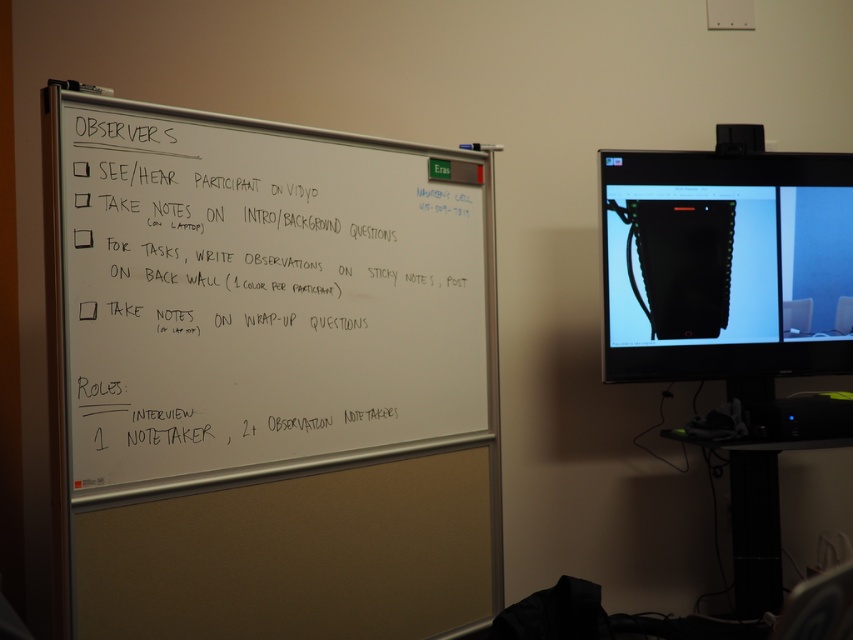
Question: Does whiteboard at left appear under matte black bag at upper right?

Choices:
 (A) no
 (B) yes

Answer: (B)

Question: Among these points, which one is farthest from the camera?

Choices:
 (A) pos(682,170)
 (B) pos(467,172)

Answer: (A)

Question: Can you confirm if whiteboard at left is thinner than matte black bag at upper right?

Choices:
 (A) yes
 (B) no

Answer: (B)

Question: Can you confirm if whiteboard at left is bigger than matte black bag at upper right?

Choices:
 (A) yes
 (B) no

Answer: (A)